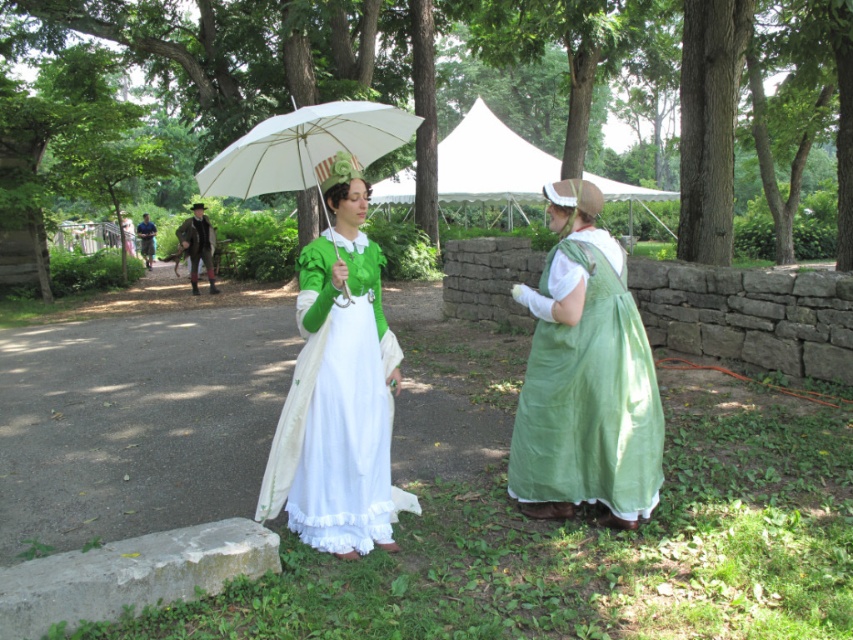
From the picture: You are taking a photo of the two points in the scene. Which point, point (254, 136) or point (526, 195), will appear larger in your camera view?

Point (254, 136) is closer to the camera than point (526, 195), so it will appear larger in the camera view.

You are standing at the point labeled as point (238,145) and want to walk towards the point labeled as point (592,458). Which direction should you move relative to your current position?

You should move backward because point (592,458) is behind point (238,145) relative to your current position.

You are a visitor at this historical event and want to take a photo of both the white matte umbrella at center and the white canvas canopy at center. Since you only have space in your frame for one of them, which one should you position closer to the left side of your camera to include both in the photo?

You should position the white matte umbrella at center closer to the left side of your camera because it is already located to the left of the white canvas canopy at center, allowing both to fit within the frame when aligned properly.